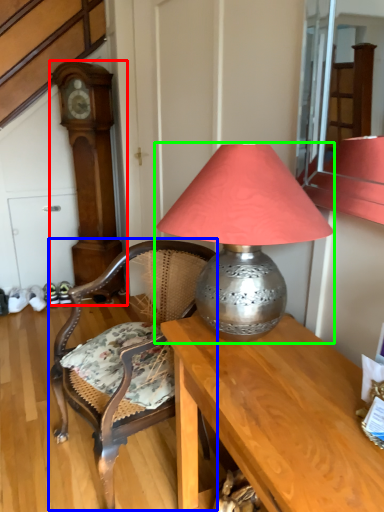
Question: Which is farther away from clock (highlighted by a red box)? chair (highlighted by a blue box) or lamp (highlighted by a green box)?

Choices:
 (A) chair
 (B) lamp

Answer: (B)